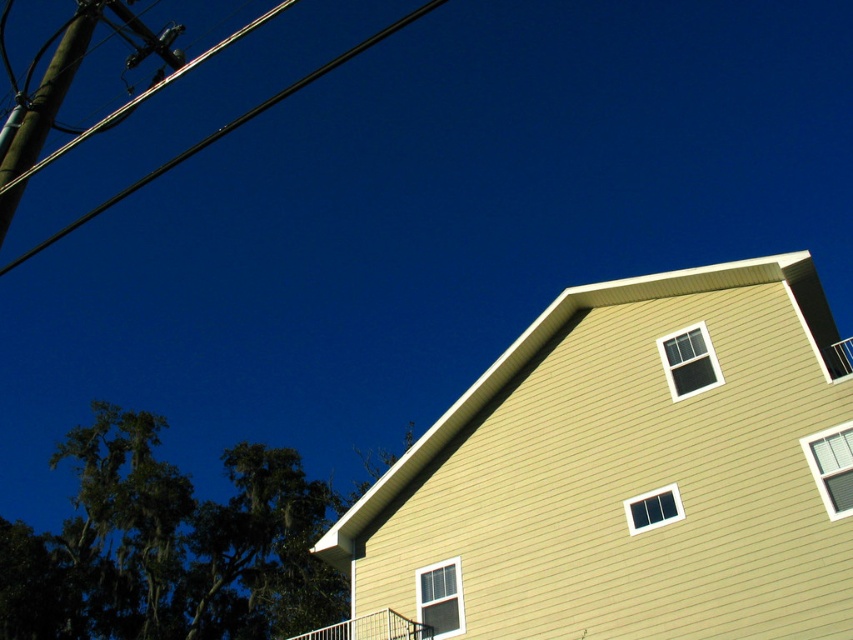
Measure the distance between brown wooden telegraph pole at upper left and black wire at upper left.

brown wooden telegraph pole at upper left and black wire at upper left are 118.99 meters apart.

Between brown wooden telegraph pole at upper left and black wire at upper left, which one is positioned higher?

black wire at upper left is above.

Does point (82, 42) come in front of point (399, 29)?

Yes, point (82, 42) is in front of point (399, 29).

Find the location of a particular element. brown wooden telegraph pole at upper left is located at coordinates (49, 92).